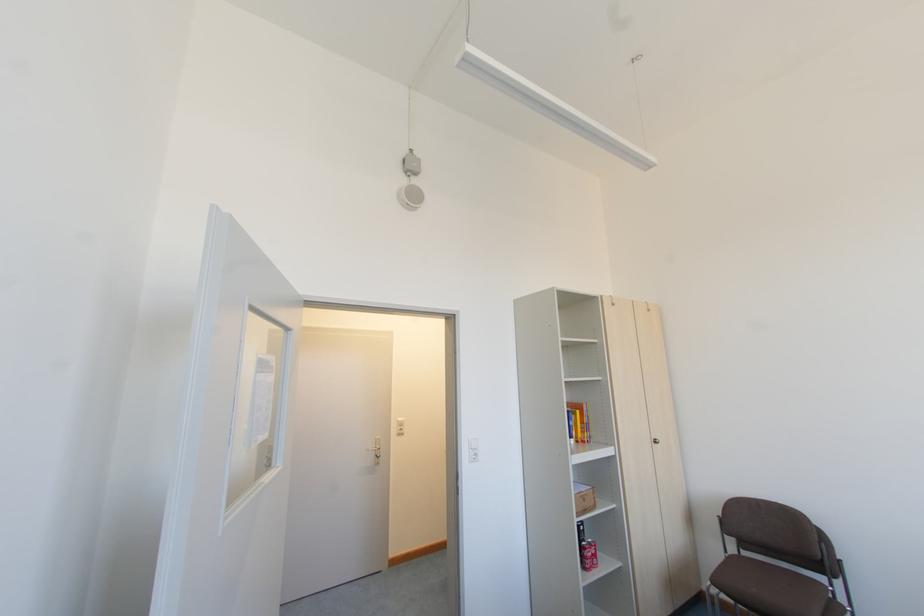
Find where to turn the metal door handle. Please return your answer as a coordinate pair (x, y).

(377, 450)